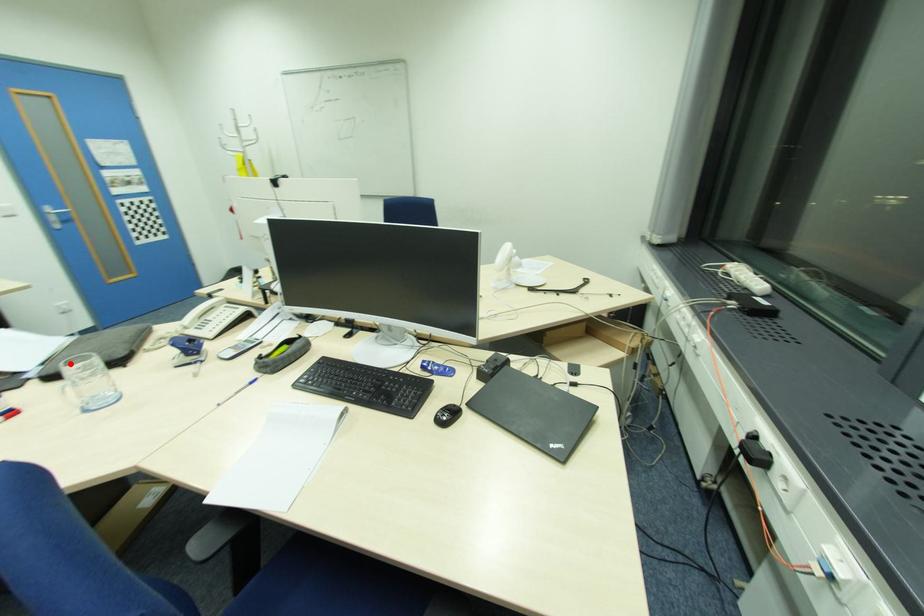
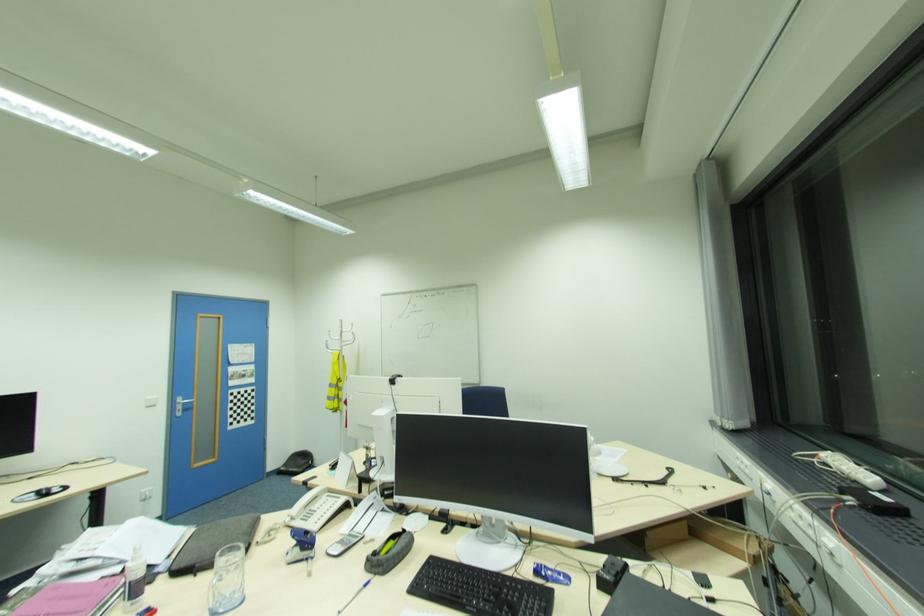
Question: I am providing you with two images of the same scene from different viewpoints. Given a red point in image1, look at the same physical point in image2. Is it:

Choices:
 (A) Closer to the viewpoint
 (B) Farther from the viewpoint

Answer: (A)